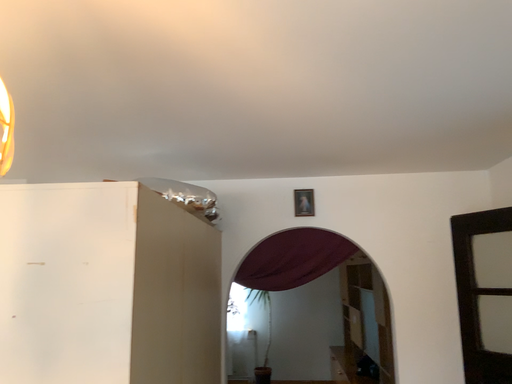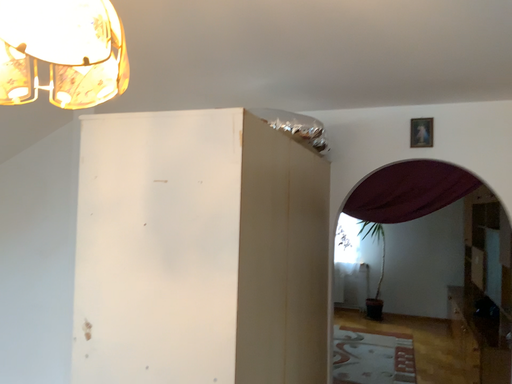
Question: Which way did the camera rotate in the video?

Choices:
 (A) rotated right
 (B) rotated left

Answer: (B)